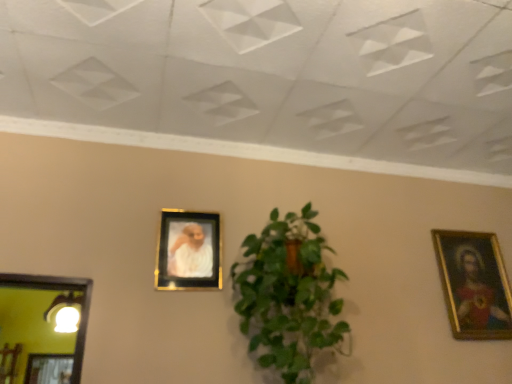
Question: Can you confirm if gold-framed painting at right, the 1th picture frame from the right, is smaller than gold metallic picture frame at center, the 2th picture frame when ordered from right to left?

Choices:
 (A) no
 (B) yes

Answer: (A)

Question: Does gold-framed painting at right, the second picture frame from the left, come behind gold metallic picture frame at center, placed as the 1th picture frame when sorted from left to right?

Choices:
 (A) yes
 (B) no

Answer: (A)

Question: Is gold-framed painting at right, the 1th picture frame from the right, facing away from gold metallic picture frame at center, placed as the 1th picture frame when sorted from left to right?

Choices:
 (A) no
 (B) yes

Answer: (A)

Question: Is gold-framed painting at right, the 1th picture frame from the right, facing towards gold metallic picture frame at center, the first picture frame viewed from the front?

Choices:
 (A) no
 (B) yes

Answer: (A)

Question: Is gold-framed painting at right, which is counted as the second picture frame, starting from the front, beside gold metallic picture frame at center, the first picture frame viewed from the front?

Choices:
 (A) no
 (B) yes

Answer: (A)

Question: Does point (481, 311) appear closer or farther from the camera than point (302, 380)?

Choices:
 (A) farther
 (B) closer

Answer: (A)

Question: In terms of width, does gold-framed painting at right, the 1th picture frame from the right, look wider or thinner when compared to green leafy plant at center?

Choices:
 (A) thin
 (B) wide

Answer: (A)

Question: Is gold-framed painting at right, the second picture frame from the left, in front of or behind green leafy plant at center in the image?

Choices:
 (A) front
 (B) behind

Answer: (B)

Question: In terms of size, does gold-framed painting at right, the 1th picture frame from the right, appear bigger or smaller than green leafy plant at center?

Choices:
 (A) small
 (B) big

Answer: (A)

Question: Is gold-framed painting at right, which appears as the 1th picture frame when viewed from the back, in front of or behind gold metallic picture frame at center, placed as the 1th picture frame when sorted from left to right, in the image?

Choices:
 (A) behind
 (B) front

Answer: (A)

Question: Based on their positions, is gold-framed painting at right, which appears as the 1th picture frame when viewed from the back, located to the left or right of gold metallic picture frame at center, the 2th picture frame when ordered from right to left?

Choices:
 (A) left
 (B) right

Answer: (B)

Question: Looking at the image, does gold-framed painting at right, which is counted as the second picture frame, starting from the front, seem bigger or smaller compared to gold metallic picture frame at center, which is counted as the second picture frame, starting from the back?

Choices:
 (A) small
 (B) big

Answer: (B)

Question: From a real-world perspective, relative to gold metallic picture frame at center, which is counted as the second picture frame, starting from the back, is gold-framed painting at right, the second picture frame from the left, vertically above or below?

Choices:
 (A) below
 (B) above

Answer: (A)

Question: In terms of width, does green leafy plant at center look wider or thinner when compared to gold-framed painting at right, the second picture frame from the left?

Choices:
 (A) wide
 (B) thin

Answer: (A)

Question: In terms of height, does green leafy plant at center look taller or shorter compared to gold-framed painting at right, which is counted as the second picture frame, starting from the front?

Choices:
 (A) short
 (B) tall

Answer: (B)